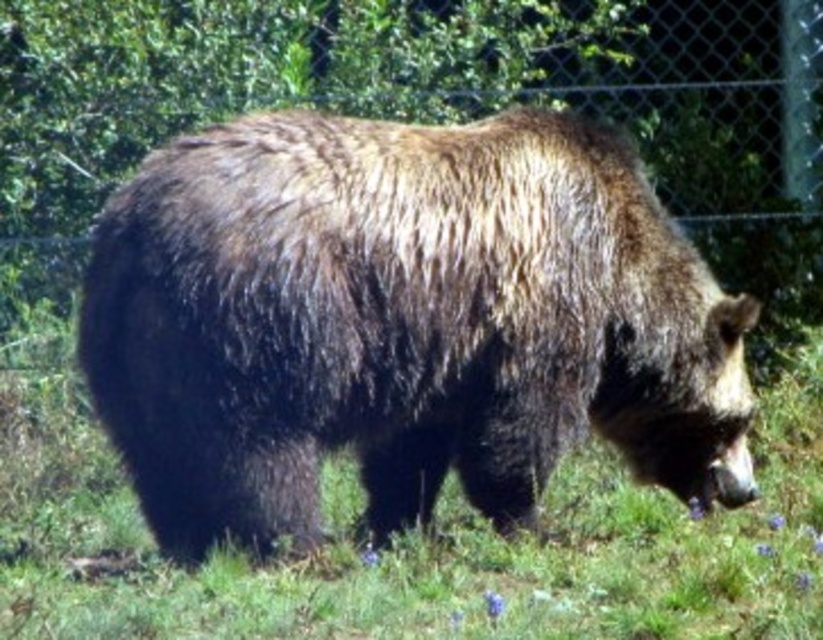
You are a photographer standing behind a chain link fence in the image. You want to take a photo of the brown fuzzy bear at center. The zoo requires that visitors stay at least 15 feet away from any animal. Are you compliant with the zoo rules?

The brown fuzzy bear at center and camera are 17.06 feet apart, so you are compliant with the zoo rules since 17.06 feet is greater than the required 15 feet distance.